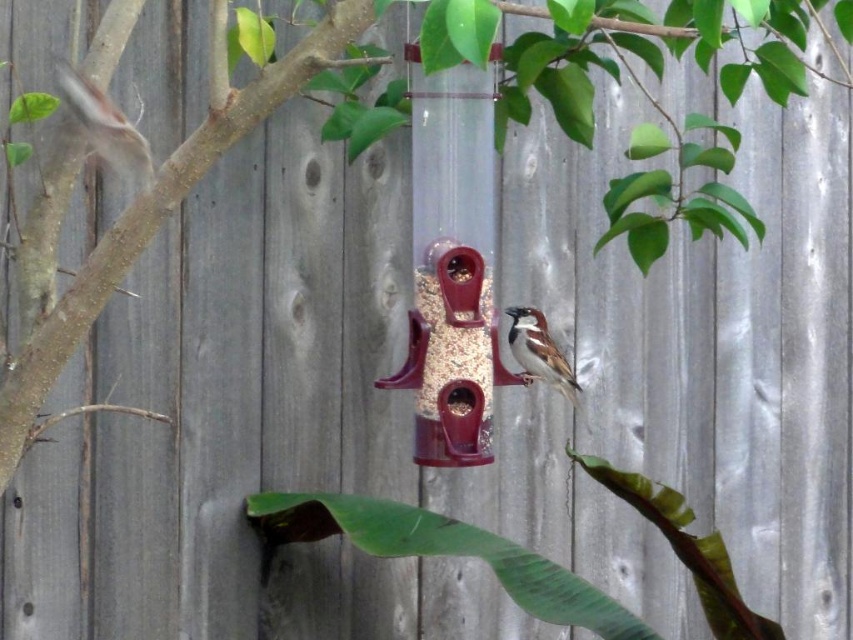
You are a birdwatcher holding a camera 2 meters above the ground. You want to photograph the matte white sparrow at upper left. Is the sparrow within your camera range if your camera can focus up to 2 meters?

The matte white sparrow at upper left is 1.95 meters away from the camera, which is within the camera focus range of 2 meters. Therefore, the sparrow is within range and can be photographed clearly.

You are a birdwatcher observing the bird feeder. You notice a matte white sparrow at upper left and a brown speckled feathers at center. Which bird is smaller in height?

The matte white sparrow at upper left is shorter than the brown speckled feathers at center, so the matte white sparrow at upper left is smaller in height.

You are a birdwatcher observing the bird feeder. You notice two birds in the scene. The first is the matte white sparrow at upper left and the second is the brown speckled feathers at center. Which bird is positioned higher in the image?

The matte white sparrow at upper left is positioned higher than the brown speckled feathers at center in the image.